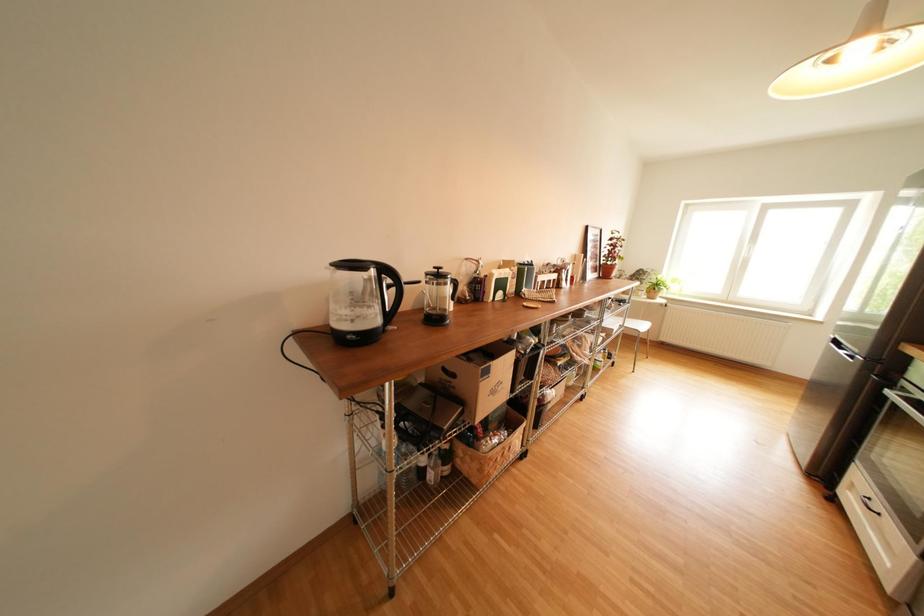
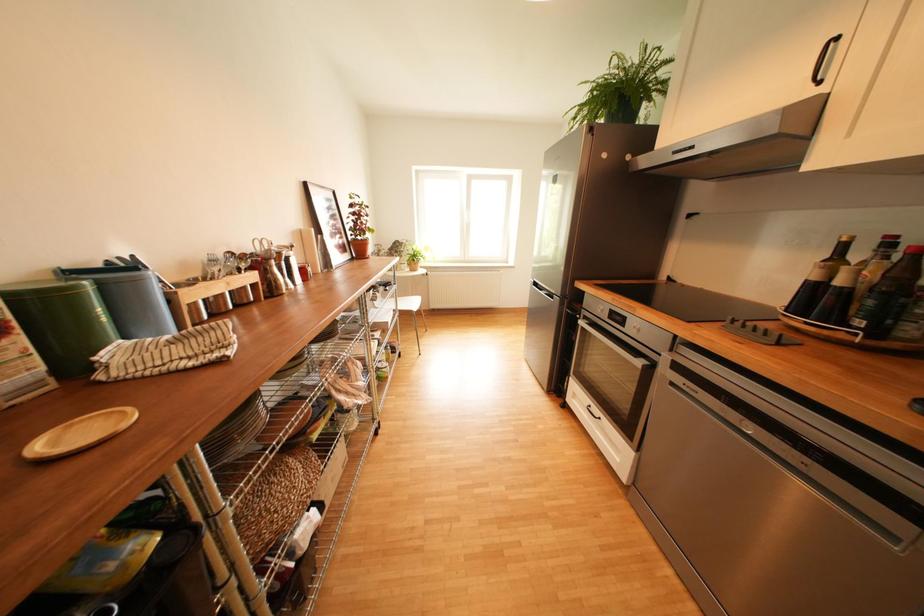
Question: The images are taken continuously from a first-person perspective. In which direction is your viewpoint rotating?

Choices:
 (A) Left
 (B) Right
 (C) Up
 (D) Down

Answer: (B)